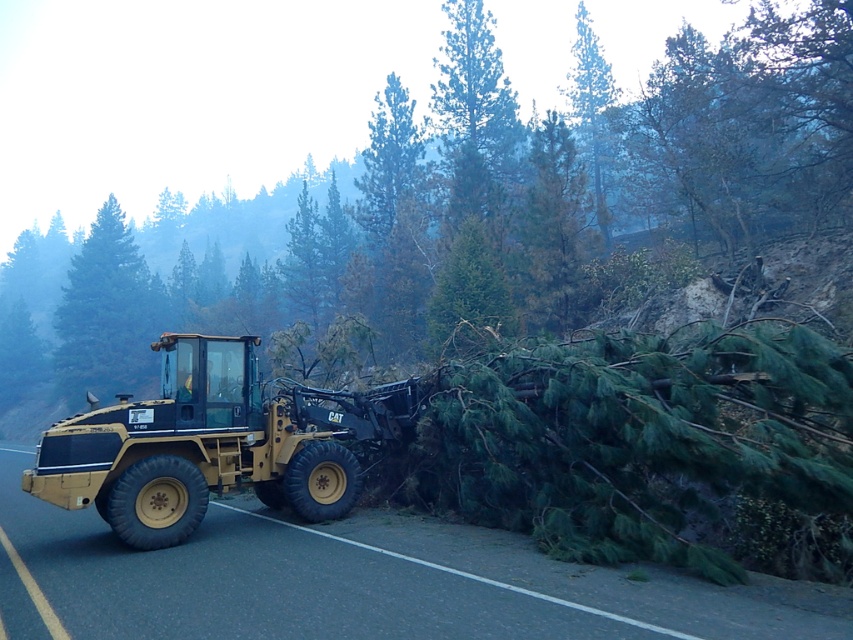
You are a construction worker who needs to transport the debris cleared by the yellow Caterpillar skid steer loader to a disposal site. The disposal site is located to the north of the current area. Given the position of the yellow rubber truck at left, which direction should you direct the skid steer loader to move the debris into the truck?

The yellow rubber truck at left is located at point (375, 582), so you should direct the skid steer loader to move the debris towards the left side of the scene to load it into the yellow rubber truck at left.

You are standing at the point labeled point (68, 378) and want to move to the point labeled point (171, 426). Considering the terrain and obstacles in the scene, which direction should you move to reach your destination?

The point labeled point (171, 426) is closer to the camera than point (68, 378). Therefore, to reach point (171, 426) from point (68, 378), you should move towards the camera or in the direction that brings you closer to the foreground.